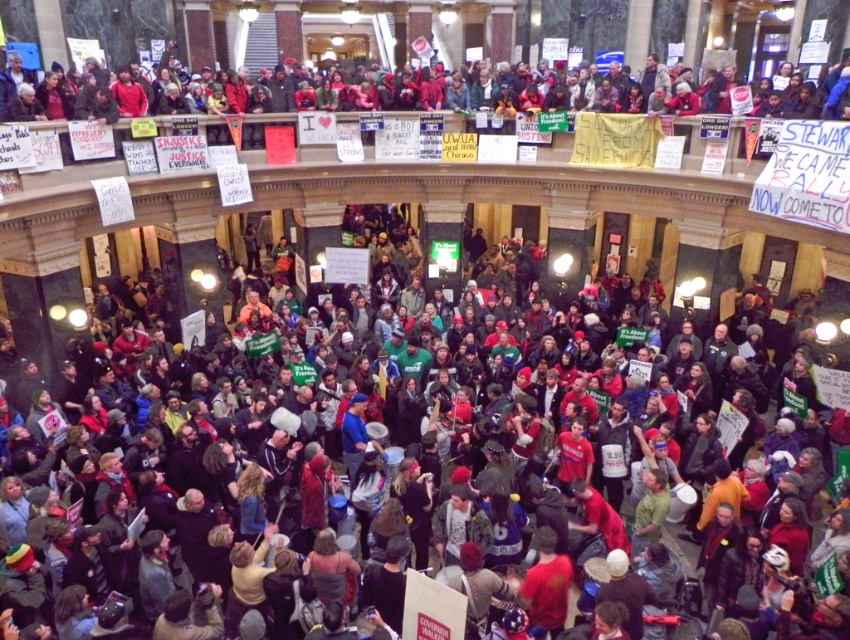
Which is behind, point (261, 416) or point (340, 99)?

The point (340, 99) is more distant.

Does multicolored fabric crowd at center have a lesser height compared to red fabric banner at upper center?

Incorrect, multicolored fabric crowd at center's height does not fall short of red fabric banner at upper center's.

Does point (451, 438) come closer to viewer compared to point (286, 104)?

Yes, it is.

Image resolution: width=850 pixels, height=640 pixels. In order to click on multicolored fabric crowd at center in this screenshot , I will do `click(350, 403)`.